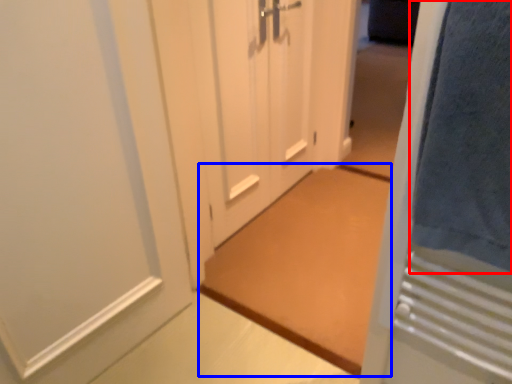
Question: Among these objects, which one is farthest to the camera, bath towel (highlighted by a red box) or doormat (highlighted by a blue box)?

Choices:
 (A) bath towel
 (B) doormat

Answer: (B)